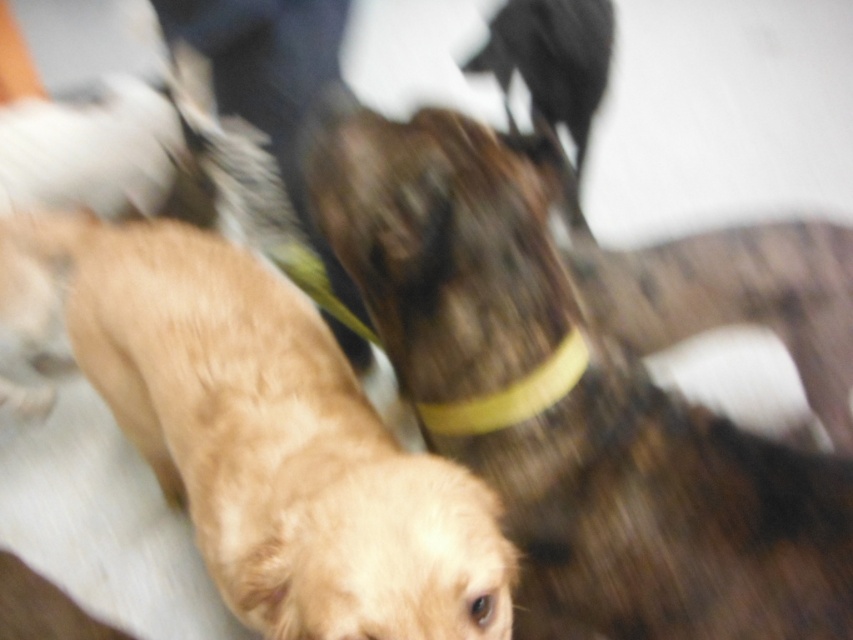
Find the location of a particular element. Image resolution: width=853 pixels, height=640 pixels. brown fuzzy dog at center is located at coordinates [569, 403].

Between brown fuzzy dog at center and yellow rubber neckband at center, which one has more height?

brown fuzzy dog at center

Where is `brown fuzzy dog at center`? The image size is (853, 640). brown fuzzy dog at center is located at coordinates (569, 403).

Is brown fuzzy dog at center wider than golden fur dog at center?

No, brown fuzzy dog at center is not wider than golden fur dog at center.

Can you confirm if brown fuzzy dog at center is taller than golden fur dog at center?

Yes.

Is point (491, 310) positioned behind point (257, 577)?

Yes, it is.

You are a GUI agent. You are given a task and a screenshot of the screen. Output one action in this format:
    pyautogui.click(x=<x>, y=<y>)
    Task: Click on the brown fuzzy dog at center
    This screenshot has width=853, height=640.
    Given the screenshot: What is the action you would take?
    (x=569, y=403)

Who is positioned more to the right, golden fur dog at center or yellow rubber neckband at center?

yellow rubber neckband at center is more to the right.

Does golden fur dog at center appear on the left side of yellow rubber neckband at center?

Yes, golden fur dog at center is to the left of yellow rubber neckband at center.

Is point (248, 380) more distant than point (538, 385)?

Yes, point (248, 380) is farther from viewer.

This screenshot has width=853, height=640. Find the location of `golden fur dog at center`. golden fur dog at center is located at coordinates (260, 433).